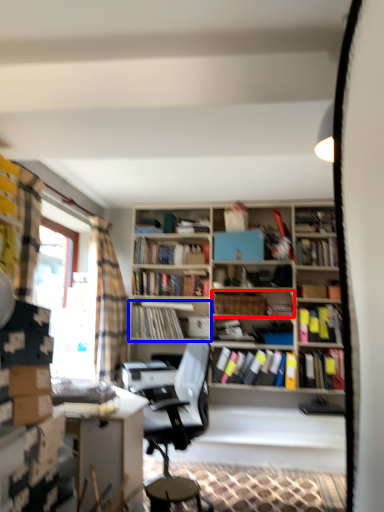
Question: Which point is further to the camera, book (highlighted by a red box) or book (highlighted by a blue box)?

Choices:
 (A) book
 (B) book

Answer: (B)